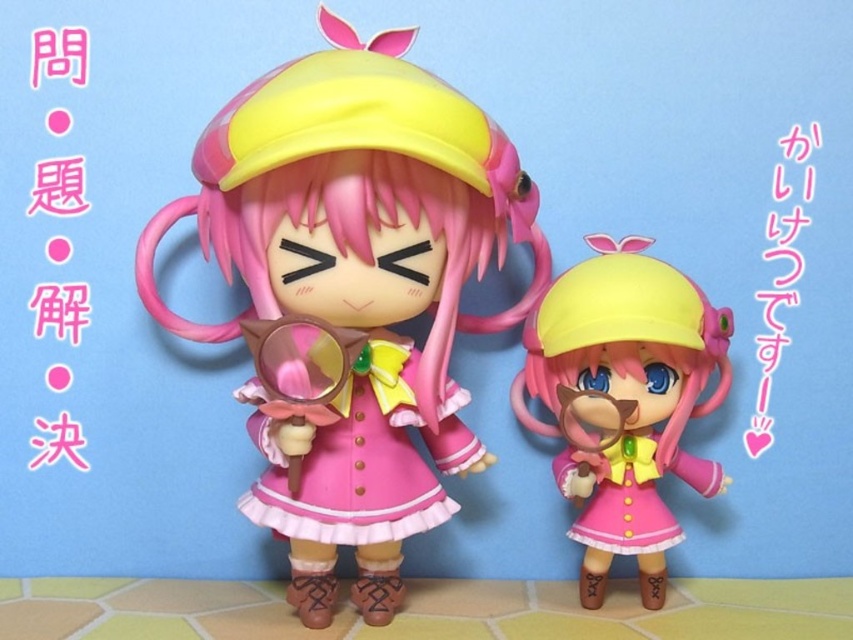
Measure the distance between point (566, 273) and camera.

Point (566, 273) and camera are 3.80 feet apart.

Is matte pink plastic toy at center taller than pink satin dress at lower right?

Correct, matte pink plastic toy at center is much taller as pink satin dress at lower right.

Is point (610, 250) positioned in front of point (607, 547)?

No.

The height and width of the screenshot is (640, 853). Identify the location of matte pink plastic toy at center. (624, 401).

Is matte pink dress at center wider than pink satin dress at center?

Yes, matte pink dress at center is wider than pink satin dress at center.

Is matte pink dress at center taller than pink satin dress at center?

Correct, matte pink dress at center is much taller as pink satin dress at center.

Is point (314, 442) less distant than point (466, 396)?

Yes, point (314, 442) is closer to viewer.

Identify the location of matte pink dress at center. This screenshot has width=853, height=640. (355, 289).

Can you confirm if matte pink dress at center is positioned to the left of matte pink plastic toy at center?

Yes, matte pink dress at center is to the left of matte pink plastic toy at center.

Who is more distant from viewer, (242, 128) or (659, 380)?

The point (659, 380) is more distant.

Is point (225, 150) positioned after point (567, 438)?

No, it is in front of (567, 438).

Locate an element on the screen. This screenshot has width=853, height=640. matte pink dress at center is located at coordinates (355, 289).